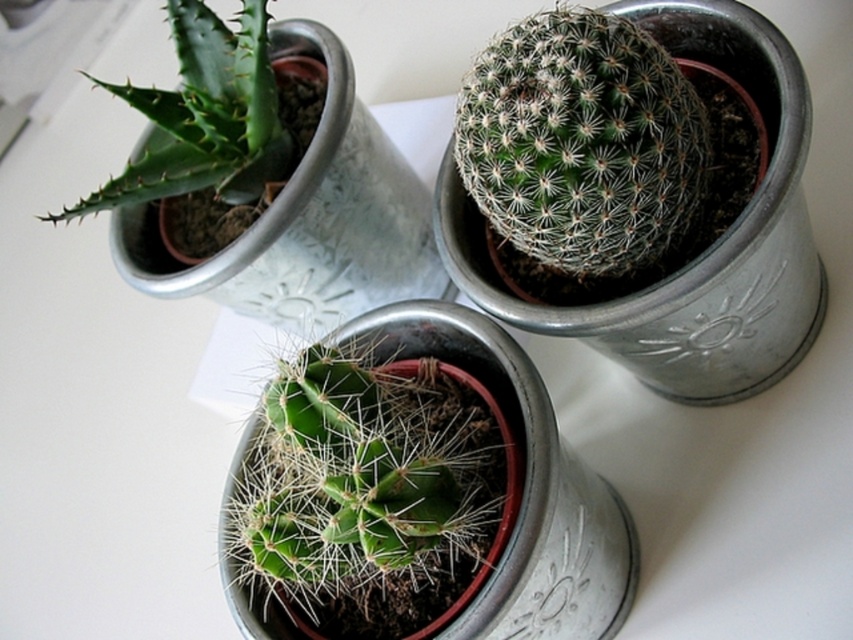
Question: Which point is farther to the camera?

Choices:
 (A) green spiny cactus at center
 (B) green spiky plant at upper left
 (C) green spiny cactus at upper right

Answer: (B)

Question: Does green spiny cactus at upper right appear on the left side of green spiky plant at upper left?

Choices:
 (A) no
 (B) yes

Answer: (A)

Question: Is green spiny cactus at center wider than green spiky plant at upper left?

Choices:
 (A) no
 (B) yes

Answer: (B)

Question: Which of these objects is positioned farthest from the green spiny cactus at upper right?

Choices:
 (A) green spiky plant at upper left
 (B) green spiny cactus at center

Answer: (A)

Question: Which object is positioned closest to the green spiny cactus at upper right?

Choices:
 (A) green spiky plant at upper left
 (B) green spiny cactus at center

Answer: (B)

Question: Is green spiny cactus at center bigger than green spiky plant at upper left?

Choices:
 (A) yes
 (B) no

Answer: (A)